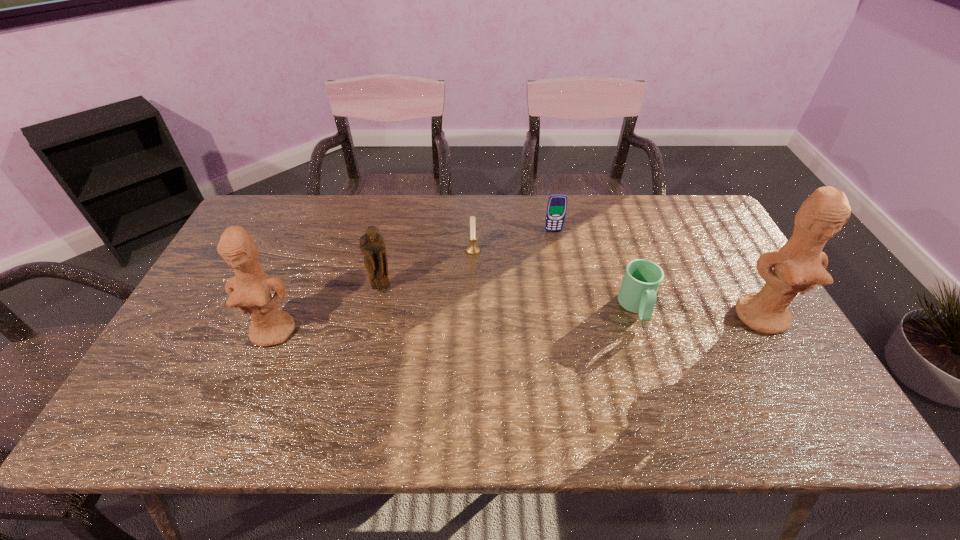
The height and width of the screenshot is (540, 960). What are the coordinates of `free space for an extra figurine to achieve even spacing` in the screenshot? It's located at (521, 324).